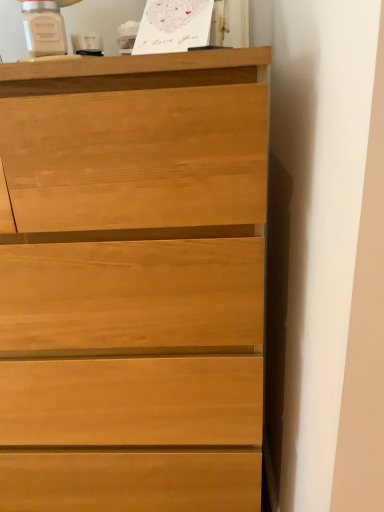
Question: In which direction should I rotate to look at light wood chest of drawers at upper center?

Choices:
 (A) right
 (B) left

Answer: (B)